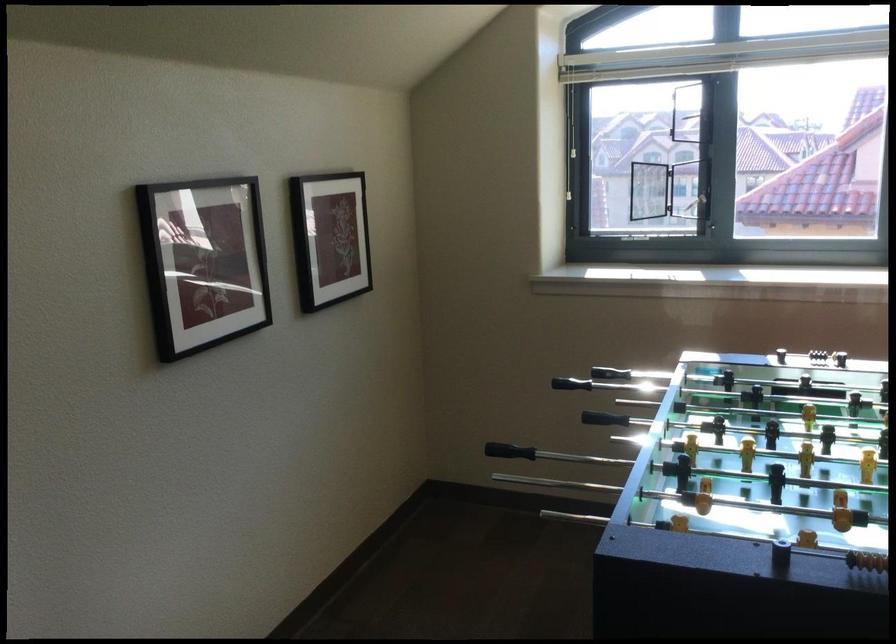
Locate an element on the screen. This screenshot has height=644, width=896. blind pull cord is located at coordinates (567, 138).